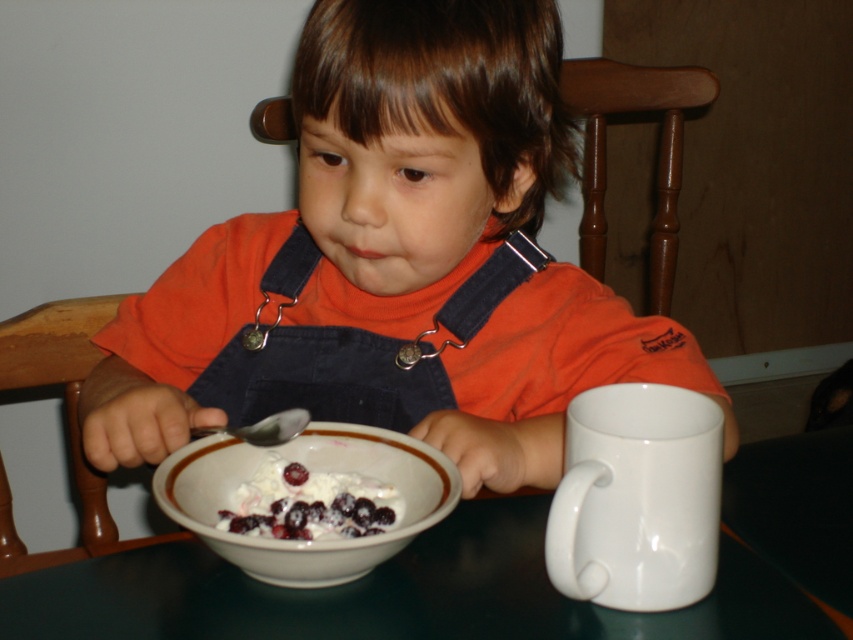
Question: Estimate the real-world distances between objects in this image. Which object is farther from the wooden chair at center?

Choices:
 (A) orange cotton shirt at center
 (B) silver metallic spoon at bowl left

Answer: (B)

Question: Does wooden chair at center have a larger size compared to white creamy dessert with blueberries at center?

Choices:
 (A) yes
 (B) no

Answer: (A)

Question: Can you confirm if white ceramic mug at right is positioned to the left of white glossy bowl at center?

Choices:
 (A) yes
 (B) no

Answer: (B)

Question: Among these points, which one is farthest from the camera?

Choices:
 (A) (605, 120)
 (B) (241, 483)
 (C) (688, 433)
 (D) (262, 422)

Answer: (A)

Question: Which of the following is the closest to the observer?

Choices:
 (A) (384, 524)
 (B) (9, 324)
 (C) (465, 61)
 (D) (442, 484)

Answer: (D)

Question: Does wooden chair at left appear under white creamy dessert with blueberries at center?

Choices:
 (A) no
 (B) yes

Answer: (B)